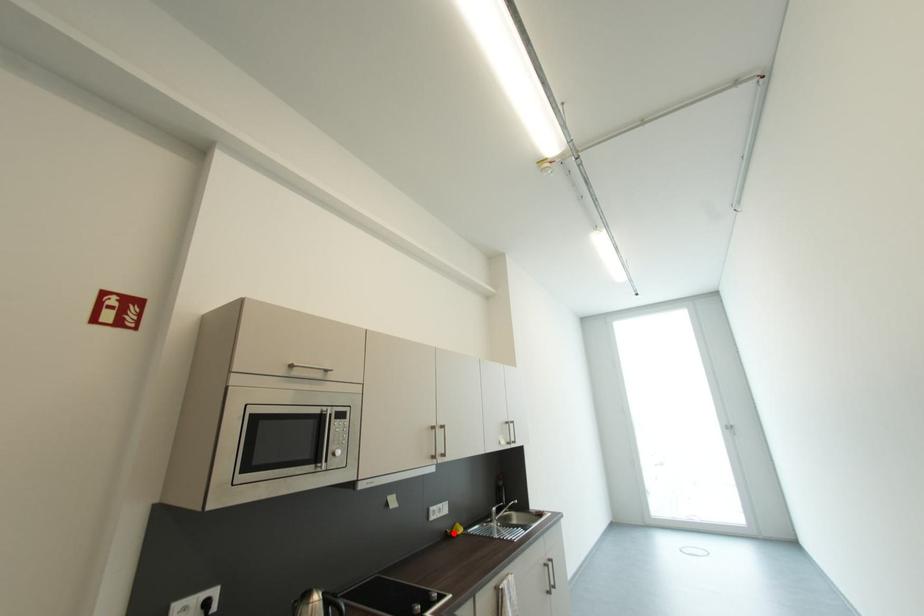
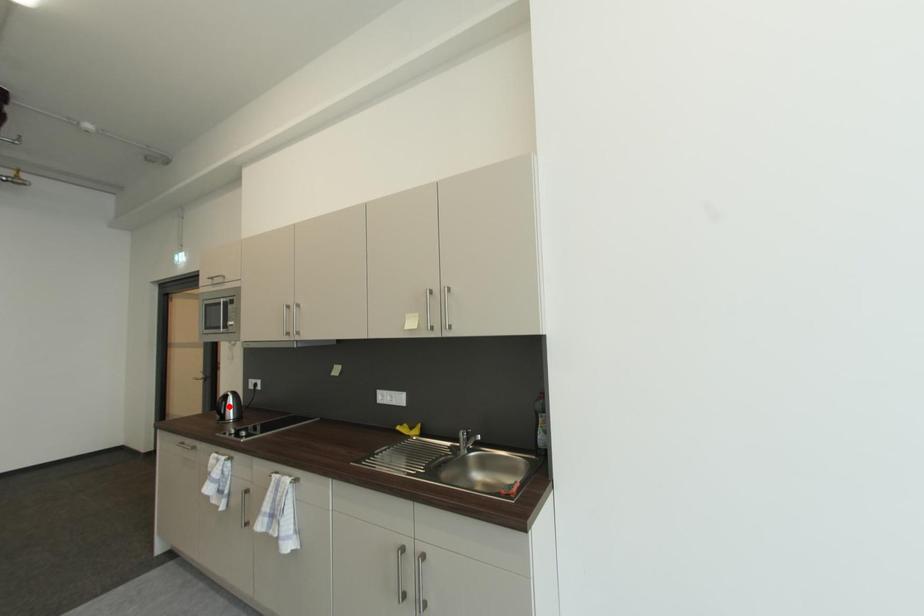
I am providing you with two images of the same scene from different viewpoints. A red point is marked on the first image and another point is marked on the second image. Is the red point in image1 aligned with the point shown in image2?

No